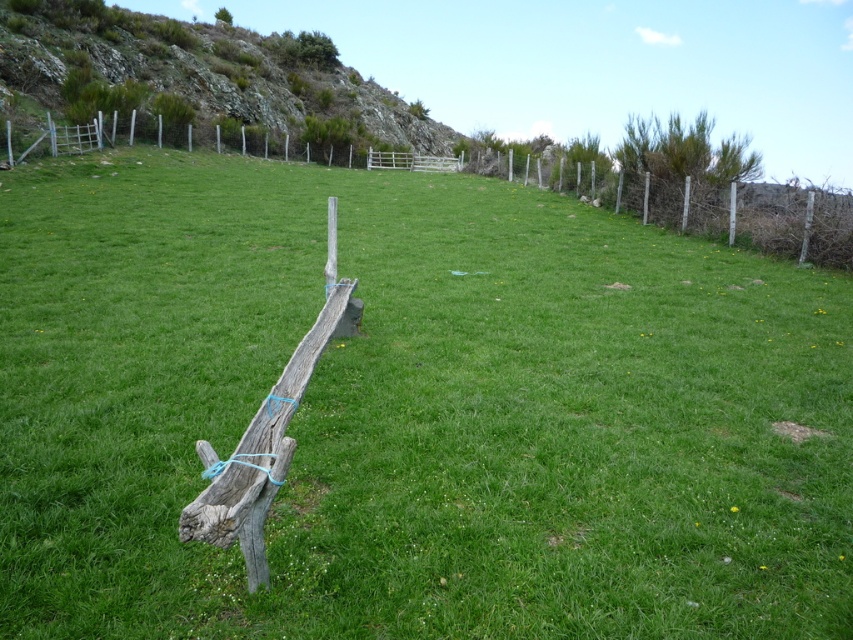
Based on the photo, you are a hiker standing at the center of the field. You want to place a GPS marker exactly at the location of the rough textured rock at upper left. What are the coordinates of the rock?

The rough textured rock at upper left is located at coordinates point (202, 74).

You are a hiker who wants to place a 15 meter long tent between the rough textured rock at upper left and the weathered wood fence at center. Can you fit the tent between them without overlapping either object?

The rough textured rock at upper left and weathered wood fence at center are 16.53 meters apart, so yes, the tent can be placed between them as the distance is greater than the tent length.

You are a farmer checking the boundaries of your property. You notice the rough textured rock at upper left and the weathered wood fence at center. Which object is more likely to block the view of your neighbor across the field?

The rough textured rock at upper left is more likely to block the view of your neighbor across the field because it might be wider than the weathered wood fence at center.